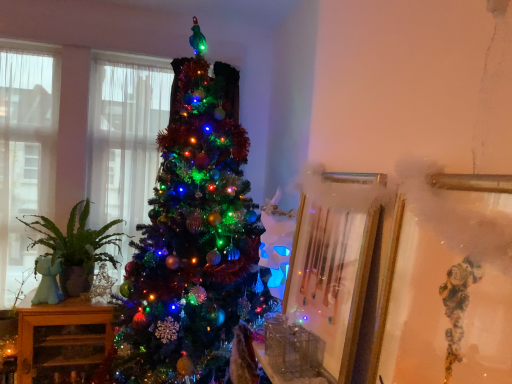
Question: From the image's perspective, is green matte plant at left on top of clear glass window at left, acting as the 2th window starting from the right?

Choices:
 (A) yes
 (B) no

Answer: (B)

Question: Is green matte plant at left taller than clear glass window at left, the 1th window in the left-to-right sequence?

Choices:
 (A) no
 (B) yes

Answer: (A)

Question: Is green matte plant at left positioned with its back to clear glass window at left, the 1th window in the left-to-right sequence?

Choices:
 (A) yes
 (B) no

Answer: (B)

Question: From the image's perspective, is green matte plant at left beneath clear glass window at left, the 1th window in the left-to-right sequence?

Choices:
 (A) yes
 (B) no

Answer: (A)

Question: Does green matte plant at left have a lesser height compared to clear glass window at left, the 1th window in the left-to-right sequence?

Choices:
 (A) no
 (B) yes

Answer: (B)

Question: Can you confirm if green matte plant at left is thinner than clear glass window at left, the 1th window in the left-to-right sequence?

Choices:
 (A) no
 (B) yes

Answer: (A)

Question: Is green matte plant at left positioned behind translucent fabric window at left, marked as the 2th window in a left-to-right arrangement?

Choices:
 (A) no
 (B) yes

Answer: (A)

Question: Would you say green matte plant at left contains translucent fabric window at left, the 1th window positioned from the right?

Choices:
 (A) yes
 (B) no

Answer: (B)

Question: From the image's perspective, is green matte plant at left under translucent fabric window at left, marked as the 2th window in a left-to-right arrangement?

Choices:
 (A) yes
 (B) no

Answer: (A)

Question: Is green matte plant at left wider than translucent fabric window at left, marked as the 2th window in a left-to-right arrangement?

Choices:
 (A) yes
 (B) no

Answer: (A)

Question: Is green matte plant at left far from translucent fabric window at left, the 1th window positioned from the right?

Choices:
 (A) yes
 (B) no

Answer: (B)

Question: Can you confirm if green matte plant at left is taller than translucent fabric window at left, the 1th window positioned from the right?

Choices:
 (A) no
 (B) yes

Answer: (A)

Question: Is the position of gold metallic picture frame at center-right, which is the 1th picture frame from back to front, more distant than that of clear glass window at left, the 1th window in the left-to-right sequence?

Choices:
 (A) yes
 (B) no

Answer: (B)